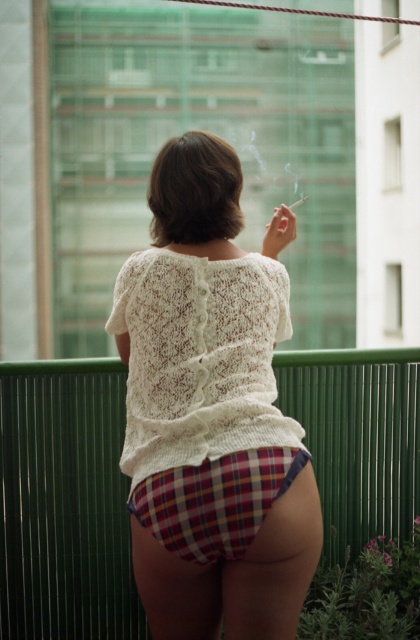
You are standing on a balcony and want to place a small potted plant exactly where the green metal fence at center is located. Is this possible?

The green metal fence at center is located at point (65,502). Since the fence is a railing, it is not a flat surface and cannot hold a potted plant.

You are trying to locate the white knitted sweater at center on the balcony. According to the coordinates provided, where exactly is it positioned?

The white knitted sweater at center is located at point coordinates [212,412].

You are a delivery drone that needs to deliver a package to the person on the balcony. The package is 4 feet in length. Can you safely place the package between the green metal fence at center and the plaid fabric underwear at lower center without it overlapping either object?

The distance between the green metal fence at center and the plaid fabric underwear at lower center is 4.65 feet. Since the package is 4 feet long, there is enough space to place it between them without overlapping either object.